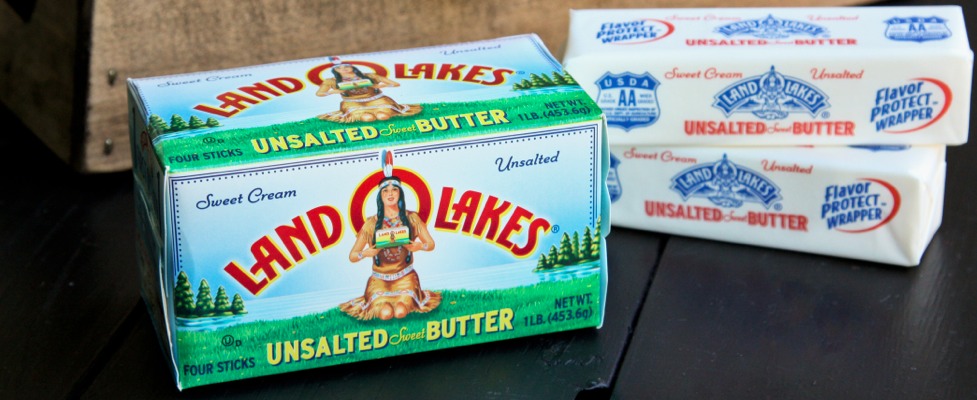
Where is `counter`? This screenshot has width=977, height=400. counter is located at coordinates (702, 353), (129, 314).